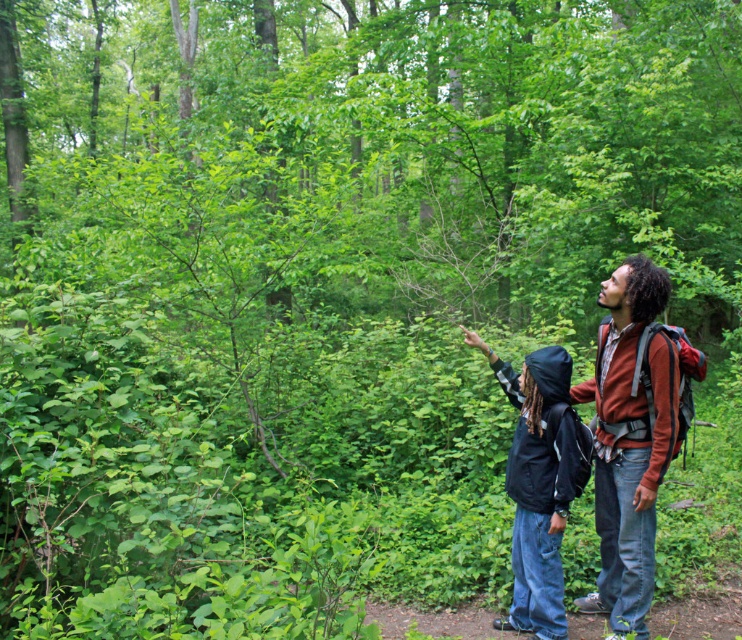
You are a fashion designer observing two people in a forest. You notice the brown cotton shirt at right and the black jacket at right. Which clothing item is wider?

Result: The black jacket at right is wider than the brown cotton shirt at right.

You are trying to decide which clothing item to take for a hike based on their sizes. The brown cotton shirt at right and the black jacket at right are available. Which one is bigger?

The brown cotton shirt at right is larger in size compared to the black jacket at right, so you should choose the brown cotton shirt at right for a more spacious fit.

You are a hiker who needs to pass between the brown cotton shirt at right and the black jacket at right. The width of your backpack is 12 inches. Can you fit through the space between them without touching either?

The brown cotton shirt at right is 12.14 inches away from the black jacket at right. Since your backpack is 12 inches wide, you can fit through the space between them without touching either.